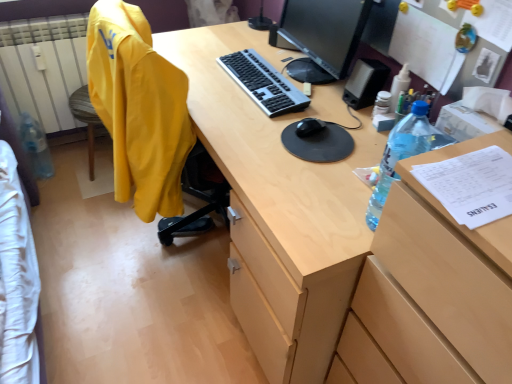
Where is `vacant space that's between translucent plastic bottle at right, which appears as the 2th bottle when viewed from the back, and black matte mouse at center`? This screenshot has width=512, height=384. vacant space that's between translucent plastic bottle at right, which appears as the 2th bottle when viewed from the back, and black matte mouse at center is located at coordinates (340, 171).